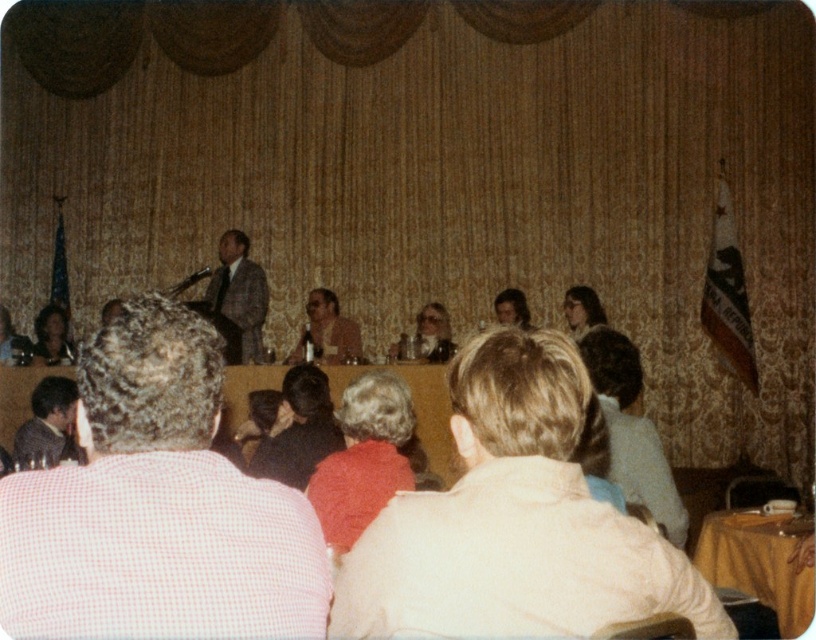
Which is in front, point (371, 499) or point (756, 556)?

Point (371, 499) is in front.

Is point (362, 465) positioned after point (774, 579)?

No, (362, 465) is closer to viewer.

Where is `red wool sweater at center`? This screenshot has height=640, width=816. red wool sweater at center is located at coordinates pos(362,458).

Can you confirm if light brown checkered shirt at center is positioned to the right of smooth brown leather jacket at lower left?

Indeed, light brown checkered shirt at center is positioned on the right side of smooth brown leather jacket at lower left.

This screenshot has height=640, width=816. I want to click on light brown checkered shirt at center, so [x=156, y=506].

Measure the distance between point (237, 577) and camera.

Point (237, 577) is 5.41 feet from camera.

The image size is (816, 640). What are the coordinates of `light brown checkered shirt at center` in the screenshot? It's located at (156, 506).

Between light beige shirt at center and blonde hair at center, which one appears on the right side from the viewer's perspective?

Positioned to the right is blonde hair at center.

Measure the distance between light beige shirt at center and blonde hair at center.

light beige shirt at center is 6.62 meters from blonde hair at center.

This screenshot has height=640, width=816. I want to click on light beige shirt at center, so click(x=513, y=522).

In order to click on light beige shirt at center in this screenshot , I will do `click(513, 522)`.